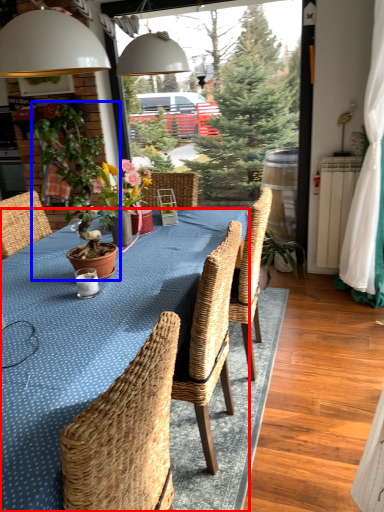
Question: Which of the following is the closest to the observer, kitchen & dining room table (highlighted by a red box) or houseplant (highlighted by a blue box)?

Choices:
 (A) kitchen & dining room table
 (B) houseplant

Answer: (A)